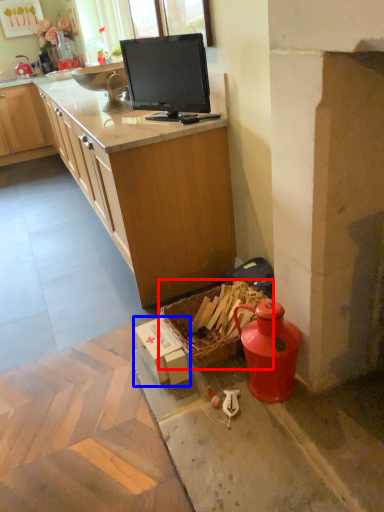
Question: Which of the following is the closest to the observer, picnic basket (highlighted by a red box) or cardboard box (highlighted by a blue box)?

Choices:
 (A) picnic basket
 (B) cardboard box

Answer: (A)